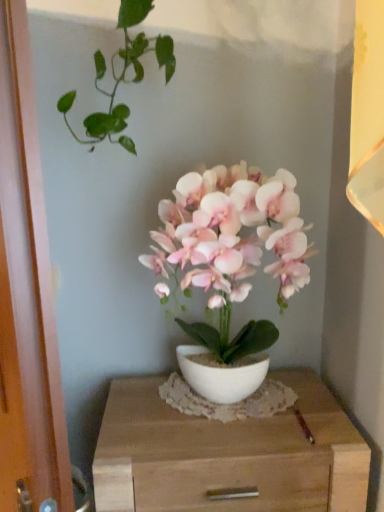
Where is `wooden door at left`? The width and height of the screenshot is (384, 512). wooden door at left is located at coordinates (26, 293).

What do you see at coordinates (26, 293) in the screenshot? I see `wooden door at left` at bounding box center [26, 293].

Where is `wooden door at left`? wooden door at left is located at coordinates point(26,293).